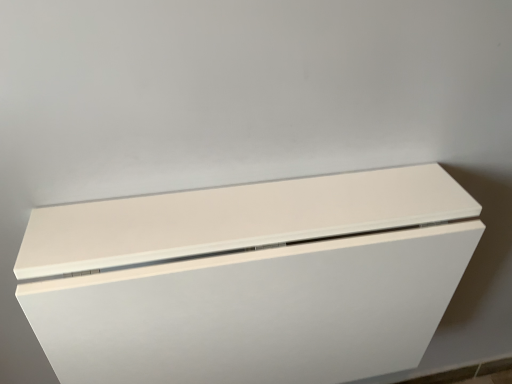
The height and width of the screenshot is (384, 512). Identify the location of free point above white matte cabinet at center (from a real-world perspective). (248, 209).